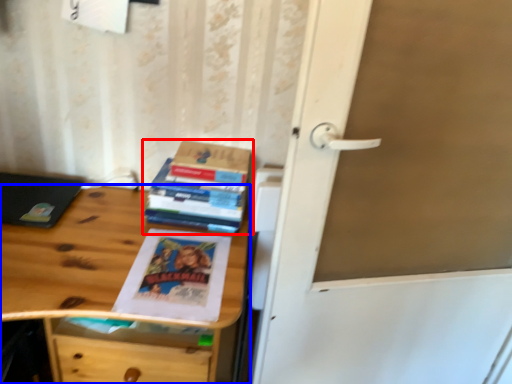
Question: Which object is further to the camera taking this photo, book (highlighted by a red box) or desk (highlighted by a blue box)?

Choices:
 (A) book
 (B) desk

Answer: (A)